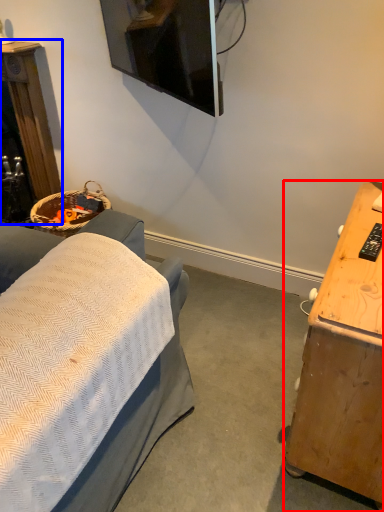
Question: Which point is closer to the camera, desk (highlighted by a red box) or furniture (highlighted by a blue box)?

Choices:
 (A) desk
 (B) furniture

Answer: (A)